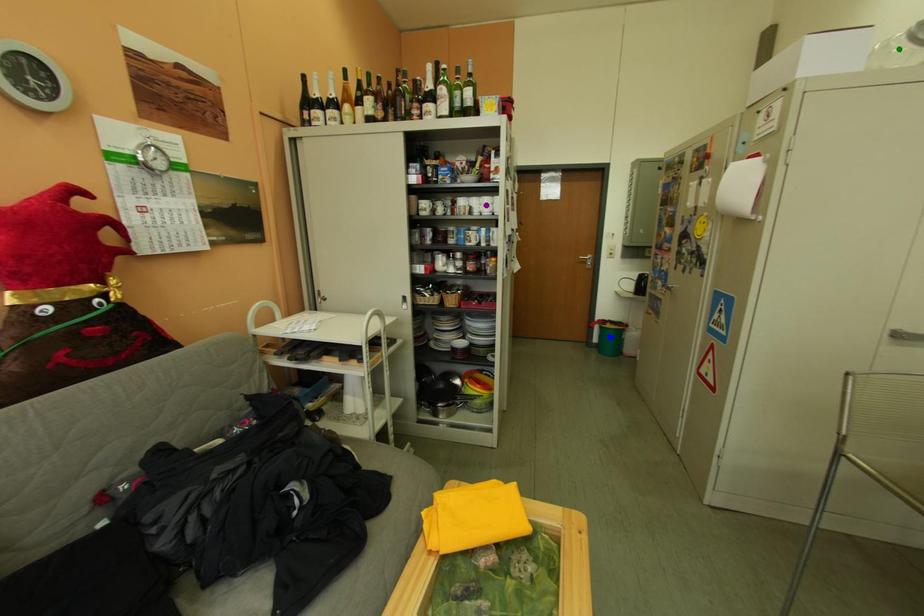
Order these from nearest to farthest:
green point
blue point
purple point

blue point → purple point → green point